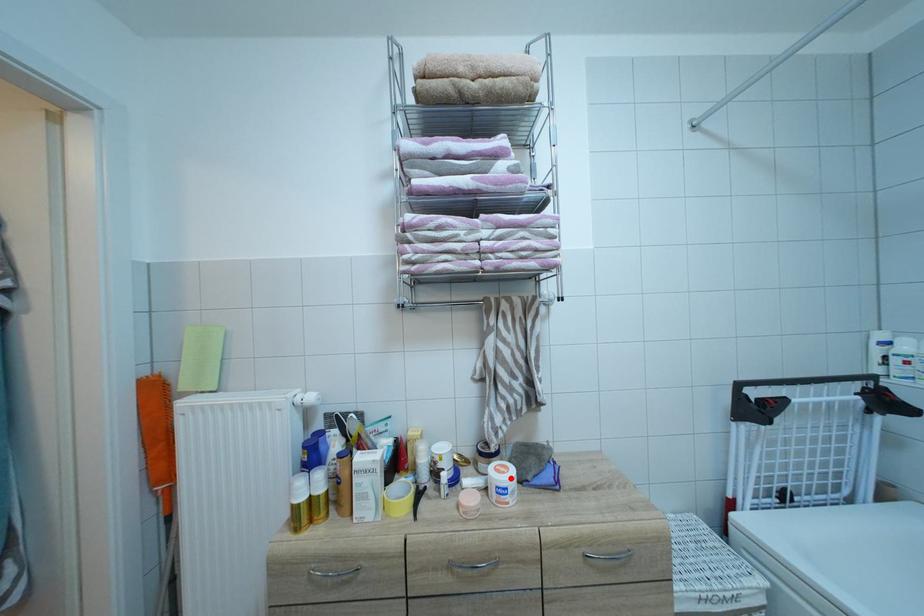
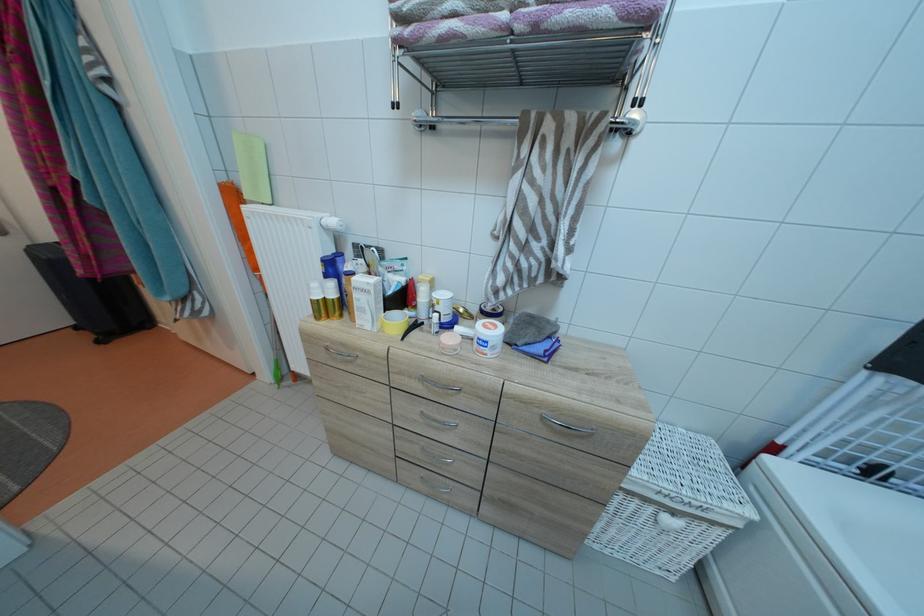
Find the pixel in the second image that matches the highlighted location in the first image.

(496, 334)